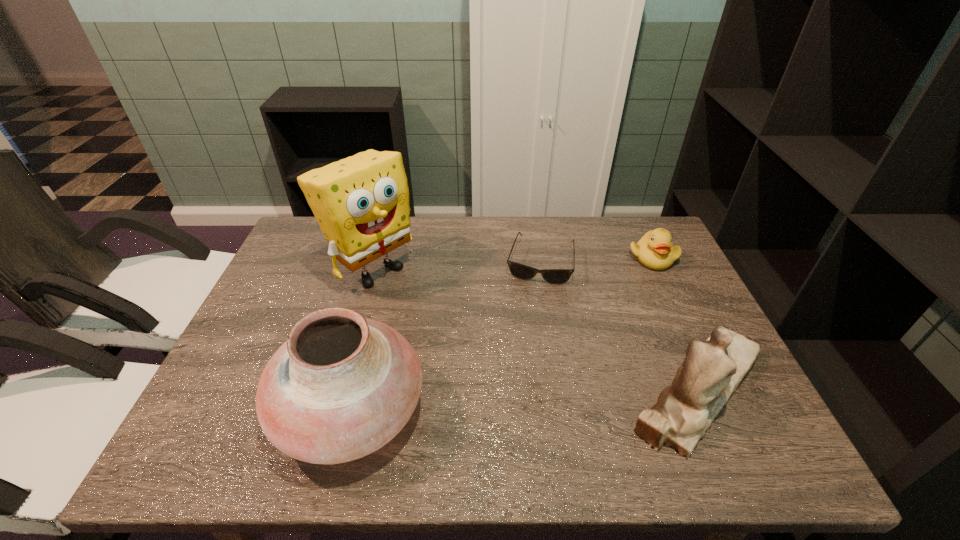
The image size is (960, 540). I want to click on figurine located in the near edge section of the desktop, so click(x=711, y=372).

Where is `pottery at the left edge`? This screenshot has height=540, width=960. pottery at the left edge is located at coordinates (342, 386).

At what (x,y) coordinates should I click in order to perform the action: click on sponge located at the left edge. Please return your answer as a coordinate pair (x, y). Looking at the image, I should click on (361, 203).

The image size is (960, 540). Find the location of `figurine situated at the right edge`. figurine situated at the right edge is located at coordinates (711, 372).

You are a GUI agent. You are given a task and a screenshot of the screen. Output one action in this format:
    pyautogui.click(x=<x>, y=<y>)
    Task: Click on the duckling located at the right edge
    The image size is (960, 540).
    Given the screenshot: What is the action you would take?
    pyautogui.click(x=654, y=250)

This screenshot has height=540, width=960. Find the location of `object that is at the far left corner`. object that is at the far left corner is located at coordinates (361, 203).

Locate an element on the screen. The height and width of the screenshot is (540, 960). object that is at the near left corner is located at coordinates (342, 386).

The width and height of the screenshot is (960, 540). I want to click on object that is at the far right corner, so click(x=654, y=250).

I want to click on object positioned at the near right corner, so click(711, 372).

This screenshot has height=540, width=960. I want to click on vacant position at the far edge of the desktop, so click(439, 254).